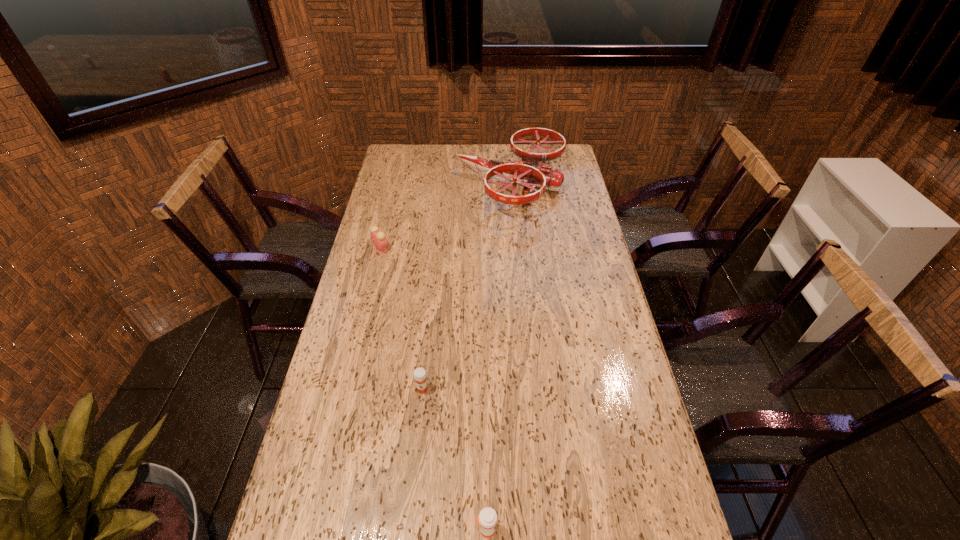
Locate an element on the screen. This screenshot has width=960, height=540. object identified as the third closest to the alarm clock is located at coordinates (487, 519).

At what (x,y) coordinates should I click in order to perform the action: click on object that can be found as the second closest to the second object from left to right. Please return your answer as a coordinate pair (x, y). Looking at the image, I should click on (378, 238).

Find the location of a particular element. Image resolution: width=960 pixels, height=540 pixels. free location that satisfies the following two spatial constraints: 1. on the label side of the second nearest object; 2. on the right side of the nearest object is located at coordinates (408, 529).

The height and width of the screenshot is (540, 960). I want to click on vacant space that satisfies the following two spatial constraints: 1. on the back side of the drone; 2. on the right side of the nearer medicine, so click(x=483, y=185).

You are a GUI agent. You are given a task and a screenshot of the screen. Output one action in this format:
    pyautogui.click(x=<x>, y=<y>)
    Task: Click on the free spot that satisfies the following two spatial constraints: 1. on the back side of the nearest object; 2. on the face of the leftmost object
    
    Given the screenshot: What is the action you would take?
    pyautogui.click(x=484, y=248)

Locate an element on the screen. free location that satisfies the following two spatial constraints: 1. on the back side of the nearest object; 2. on the left side of the drone is located at coordinates (483, 185).

The width and height of the screenshot is (960, 540). I want to click on free location that satisfies the following two spatial constraints: 1. on the face of the nearest object; 2. on the left side of the second farthest object, so click(x=314, y=529).